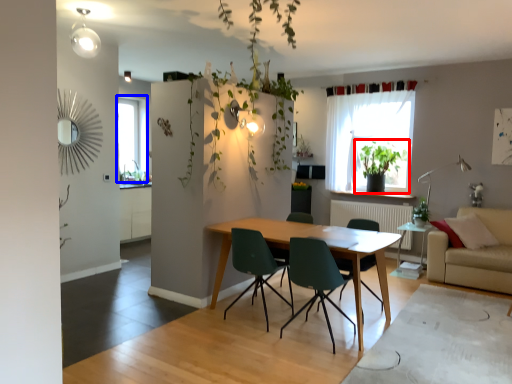
Question: Which point is closer to the camera, houseplant (highlighted by a red box) or window (highlighted by a blue box)?

Choices:
 (A) houseplant
 (B) window

Answer: (A)